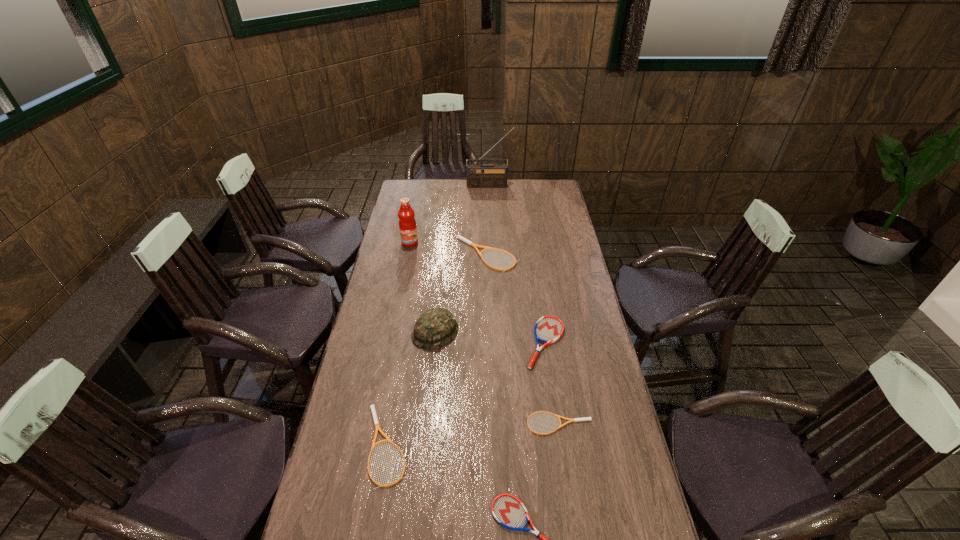
The image size is (960, 540). Identify the location of tennis racket at the left edge. (377, 427).

This screenshot has height=540, width=960. What are the coordinates of `free space at the left edge of the desktop` in the screenshot? It's located at (348, 528).

What are the coordinates of `vacant space at the right edge of the desktop` in the screenshot? It's located at (585, 330).

Locate an element on the screen. The image size is (960, 540). vacant space at the far left corner of the desktop is located at coordinates (400, 188).

Identify the location of free space at the far right corner of the desktop. The width and height of the screenshot is (960, 540). (545, 182).

Where is `vacant area that lies between the farther blue tennis racket and the tallest object`? This screenshot has width=960, height=540. vacant area that lies between the farther blue tennis racket and the tallest object is located at coordinates (517, 264).

Locate an element on the screen. The image size is (960, 540). vacant region between the leftmost beige tennis racket and the biggest beige tennis racket is located at coordinates (438, 350).

The image size is (960, 540). I want to click on empty space that is in between the headwear and the second smallest beige tennis racket, so click(x=411, y=389).

Identify the location of vacant space in between the smallest beige tennis racket and the fruit juice. (485, 333).

In order to click on blank region between the farthest object and the farther blue tennis racket in this screenshot , I will do `click(517, 264)`.